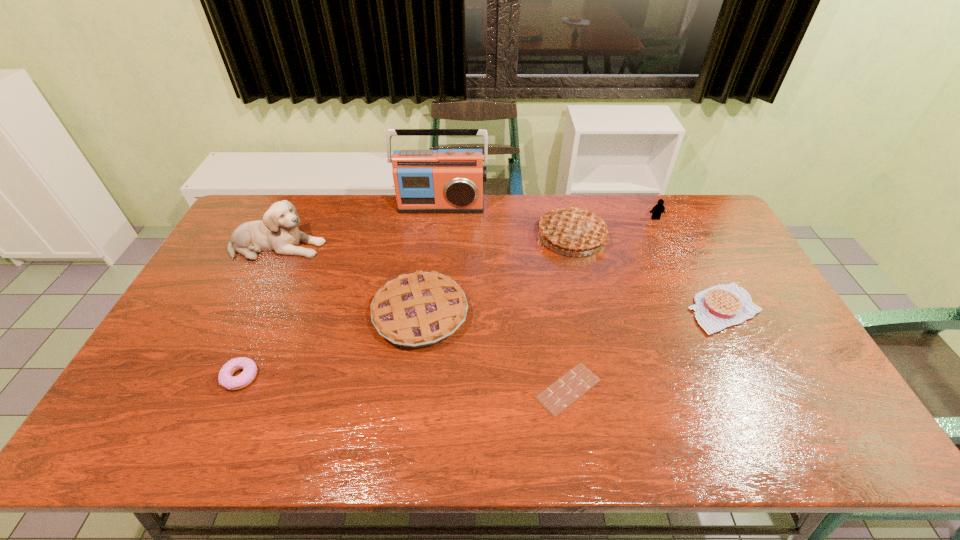
Find the location of a particular element. Image resolution: width=960 pixels, height=540 pixels. the third closest object to the tallest object is located at coordinates (420, 309).

This screenshot has height=540, width=960. I want to click on the second closest pie to the doughnut, so click(574, 229).

You are a GUI agent. You are given a task and a screenshot of the screen. Output one action in this format:
    pyautogui.click(x=<x>, y=<y>)
    Task: Click on the closest pie to the shortest pie
    The image size is (960, 540).
    Given the screenshot: What is the action you would take?
    click(x=574, y=229)

Locate an element on the screen. Image resolution: width=960 pixels, height=540 pixels. vacant region that satisfies the following two spatial constraints: 1. on the front-facing side of the tallest object; 2. on the left side of the shortest pie is located at coordinates coord(430,309).

The width and height of the screenshot is (960, 540). I want to click on vacant point that satisfies the following two spatial constraints: 1. on the face of the Lego; 2. on the right side of the shortest pie, so click(x=697, y=309).

You are a GUI agent. You are given a task and a screenshot of the screen. Output one action in this format:
    pyautogui.click(x=<x>, y=<y>)
    Task: Click on the free space that satisfies the following two spatial constraints: 1. on the front-facing side of the tallest object; 2. on the right side of the farthest pie
    The height and width of the screenshot is (540, 960).
    Given the screenshot: What is the action you would take?
    [x=438, y=237]

Where is `blank space that satisfies the following two spatial constraints: 1. on the front-facing side of the shortest pie; 2. on the right side of the tallest object`? The width and height of the screenshot is (960, 540). blank space that satisfies the following two spatial constraints: 1. on the front-facing side of the shortest pie; 2. on the right side of the tallest object is located at coordinates (430, 309).

The width and height of the screenshot is (960, 540). I want to click on vacant area in the image that satisfies the following two spatial constraints: 1. on the front-facing side of the farthest pie; 2. on the right side of the radio receiver, so click(x=438, y=237).

Where is `vacant space that satisfies the following two spatial constraints: 1. on the back side of the shortest object; 2. on the right side of the shortest pie`? This screenshot has height=540, width=960. vacant space that satisfies the following two spatial constraints: 1. on the back side of the shortest object; 2. on the right side of the shortest pie is located at coordinates (555, 309).

Image resolution: width=960 pixels, height=540 pixels. Identify the location of vacant space that satisfies the following two spatial constraints: 1. on the face of the fifth shortest object; 2. on the left side of the rightmost pie. (697, 309).